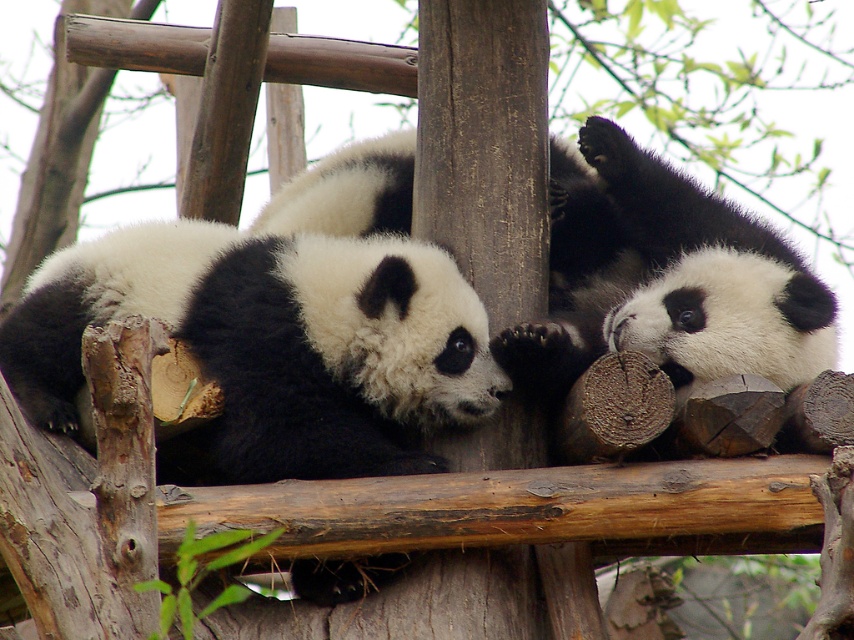
You are a zookeeper observing two panda cubs in their enclosure. You notice a black and white fur panda at center and a black fuzzy panda at center. Which panda takes up more space in the image?

The black fuzzy panda at center occupies more space than the black and white fur panda at center.

You are a zookeeper observing two panda cubs in their enclosure. You notice a black and white fur panda at center and a black fuzzy panda at center. Which panda is partially hidden from your view?

The black fuzzy panda at center is behind the black and white fur panda at center, so it is partially hidden from view.

You are a zookeeper observing two pandas in their enclosure. You notice the black and white fur panda at center and the black fuzzy panda at center. Which panda is positioned lower in the image?

The black and white fur panda at center is positioned lower because it is below the black fuzzy panda at center.